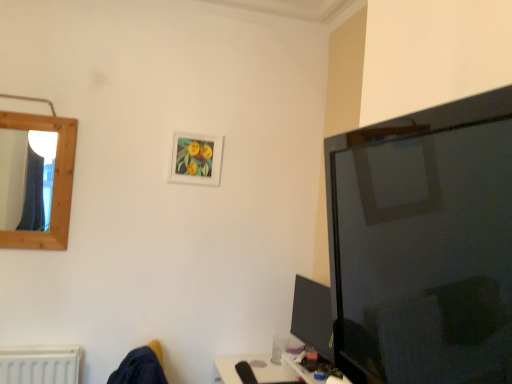
Question: Can you confirm if white matte picture frame at center is shorter than matte black monitor at lower right?

Choices:
 (A) no
 (B) yes

Answer: (B)

Question: Does white matte picture frame at center contain matte black monitor at lower right?

Choices:
 (A) yes
 (B) no

Answer: (B)

Question: Is white matte picture frame at center smaller than matte black monitor at lower right?

Choices:
 (A) no
 (B) yes

Answer: (B)

Question: From a real-world perspective, is white matte picture frame at center located beneath matte black monitor at lower right?

Choices:
 (A) yes
 (B) no

Answer: (B)

Question: Is white matte picture frame at center to the left of matte black monitor at lower right from the viewer's perspective?

Choices:
 (A) yes
 (B) no

Answer: (A)

Question: Could you tell me if white matte picture frame at center is turned towards matte black monitor at lower right?

Choices:
 (A) yes
 (B) no

Answer: (B)

Question: Does matte black monitor at lower right turn towards white matte picture frame at center?

Choices:
 (A) no
 (B) yes

Answer: (A)

Question: Considering the relative positions of matte black monitor at lower right and white matte picture frame at center in the image provided, is matte black monitor at lower right to the right of white matte picture frame at center from the viewer's perspective?

Choices:
 (A) no
 (B) yes

Answer: (B)

Question: From a real-world perspective, is matte black monitor at lower right positioned over white matte picture frame at center based on gravity?

Choices:
 (A) no
 (B) yes

Answer: (A)

Question: Are matte black monitor at lower right and white matte picture frame at center making contact?

Choices:
 (A) yes
 (B) no

Answer: (B)

Question: From the image's perspective, is matte black monitor at lower right below white matte picture frame at center?

Choices:
 (A) no
 (B) yes

Answer: (B)

Question: Would you say matte black monitor at lower right is outside white matte picture frame at center?

Choices:
 (A) no
 (B) yes

Answer: (B)

Question: From the image's perspective, relative to white matte picture frame at center, is matte black monitor at lower right above or below?

Choices:
 (A) above
 (B) below

Answer: (B)